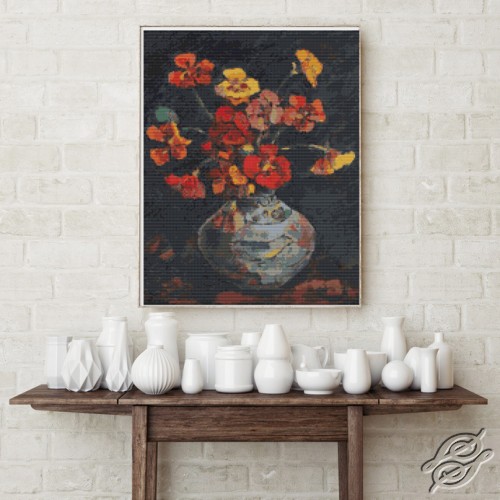
Locate an element on the screen. table is located at coordinates (417, 399).